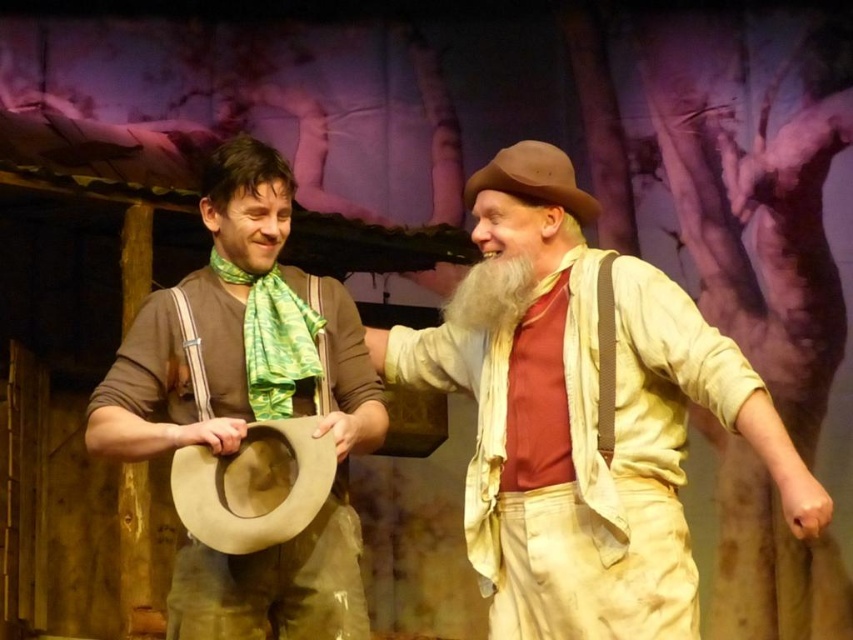
Question: From the image, what is the correct spatial relationship of beige cotton shirt at center in relation to white fluffy beard at center?

Choices:
 (A) below
 (B) above

Answer: (A)

Question: Is the position of brown leather hat at left less distant than that of brown suede cowboy hat at left?

Choices:
 (A) no
 (B) yes

Answer: (A)

Question: Considering the real-world distances, which object is closest to the brown suede cowboy hat at left?

Choices:
 (A) beige cotton shirt at center
 (B) brown felt hat at upper center
 (C) brown leather hat at left
 (D) white fluffy beard at center

Answer: (C)

Question: Which object appears closest to the camera in this image?

Choices:
 (A) brown suede cowboy hat at left
 (B) beige cotton shirt at center

Answer: (B)

Question: Which of the following is the closest to the observer?

Choices:
 (A) (485, 307)
 (B) (625, 444)
 (C) (270, 476)

Answer: (C)

Question: Observing the image, what is the correct spatial positioning of brown felt hat at upper center in reference to white fluffy beard at center?

Choices:
 (A) above
 (B) below

Answer: (A)